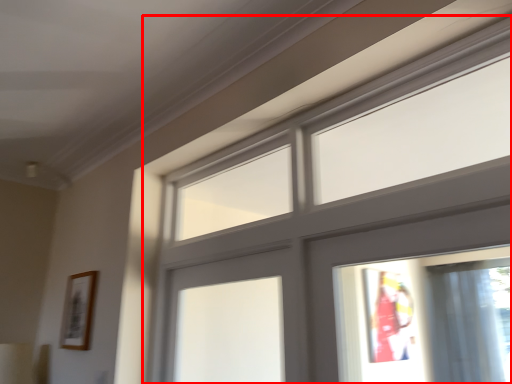
Question: Considering the relative positions of window (annotated by the red box) and picture frame in the image provided, where is window (annotated by the red box) located with respect to the staircase?

Choices:
 (A) right
 (B) left

Answer: (A)